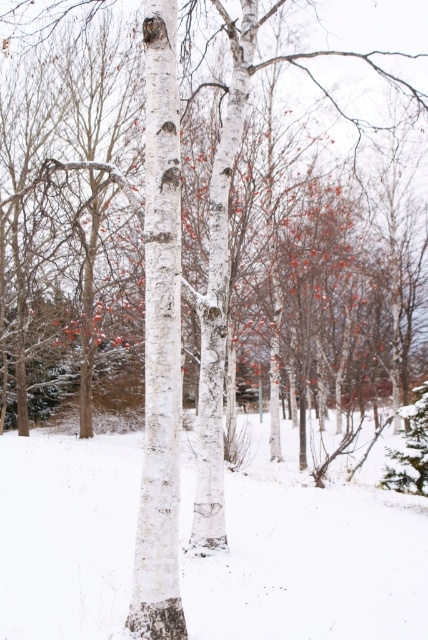
Question: Which of the following is the closest to the observer?

Choices:
 (A) white matte snow at center
 (B) white matte tree trunk at center

Answer: (B)

Question: Which point is closer to the camera?

Choices:
 (A) (157, 262)
 (B) (288, 429)

Answer: (A)

Question: Is white matte snow at center positioned at the back of white matte tree trunk at center?

Choices:
 (A) yes
 (B) no

Answer: (A)

Question: Can you confirm if white matte snow at center is positioned below white matte tree trunk at center?

Choices:
 (A) no
 (B) yes

Answer: (B)

Question: Is white matte snow at center positioned before white matte tree trunk at center?

Choices:
 (A) yes
 (B) no

Answer: (B)

Question: Which point is closer to the camera?

Choices:
 (A) (174, 205)
 (B) (404, 609)

Answer: (A)